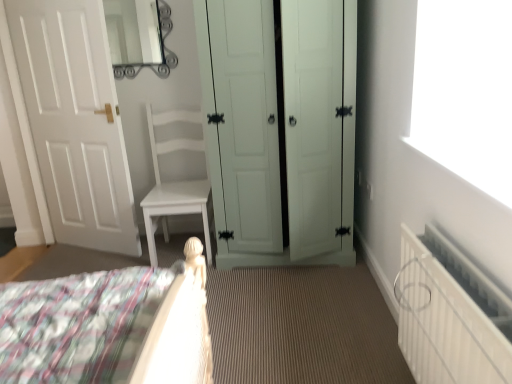
Question: Can you confirm if white textured radiator at lower right is taller than metallic silver mirror at upper center?

Choices:
 (A) no
 (B) yes

Answer: (B)

Question: From a real-world perspective, is white textured radiator at lower right on top of metallic silver mirror at upper center?

Choices:
 (A) yes
 (B) no

Answer: (B)

Question: From the image's perspective, is white textured radiator at lower right over metallic silver mirror at upper center?

Choices:
 (A) no
 (B) yes

Answer: (A)

Question: Is metallic silver mirror at upper center at the back of white textured radiator at lower right?

Choices:
 (A) yes
 (B) no

Answer: (B)

Question: Is white textured radiator at lower right to the right of metallic silver mirror at upper center from the viewer's perspective?

Choices:
 (A) yes
 (B) no

Answer: (A)

Question: In terms of size, does light green wood wardrobe at center, the first door in the right-to-left sequence, appear bigger or smaller than white matte door at left, acting as the 2th door starting from the right?

Choices:
 (A) big
 (B) small

Answer: (A)

Question: Is point (224, 11) closer or farther from the camera than point (91, 218)?

Choices:
 (A) farther
 (B) closer

Answer: (B)

Question: Would you say light green wood wardrobe at center, the first door in the right-to-left sequence, is inside or outside white matte door at left, which is counted as the 1th door, starting from the left?

Choices:
 (A) outside
 (B) inside

Answer: (A)

Question: Is light green wood wardrobe at center, which is the 2th door in left-to-right order, taller or shorter than white matte door at left, which is counted as the 1th door, starting from the left?

Choices:
 (A) tall
 (B) short

Answer: (B)

Question: Considering their positions, is white textured radiator at lower right located in front of or behind light green wood wardrobe at center, the first door in the right-to-left sequence?

Choices:
 (A) front
 (B) behind

Answer: (A)

Question: Looking at their shapes, would you say white textured radiator at lower right is wider or thinner than light green wood wardrobe at center, which is the 2th door in left-to-right order?

Choices:
 (A) thin
 (B) wide

Answer: (A)

Question: Considering the positions of white textured radiator at lower right and light green wood wardrobe at center, the first door in the right-to-left sequence, in the image, is white textured radiator at lower right taller or shorter than light green wood wardrobe at center, the first door in the right-to-left sequence,?

Choices:
 (A) short
 (B) tall

Answer: (A)

Question: Does point pos(498,365) appear closer or farther from the camera than point pos(222,104)?

Choices:
 (A) closer
 (B) farther

Answer: (A)

Question: Is point (116, 46) closer or farther from the camera than point (260, 6)?

Choices:
 (A) closer
 (B) farther

Answer: (B)

Question: Visually, is metallic silver mirror at upper center positioned to the left or to the right of light green wood wardrobe at center, which is the 2th door in left-to-right order?

Choices:
 (A) right
 (B) left

Answer: (B)